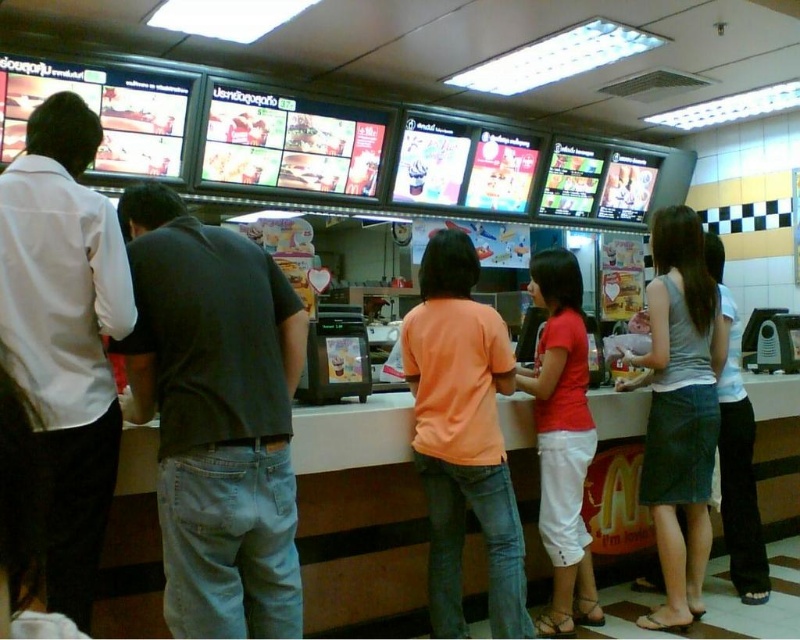
You are a customer at McDonalds and you want to find the dark gray jeans at center. Where would you look in the restaurant?

The dark gray jeans at center are located at the coordinates point (216, 417) in the restaurant.

You are standing at the counter in a McDonalds restaurant and see a point marked at coordinates (680, 410). What object is located at that point?

The point at coordinates (680, 410) corresponds to the denim skirt at center.

You are a customer at McDonalds and you want to order a burger. You see an employee wearing an orange matte shirt at center and another employee in light blue denim jeans at lower right. Which employee is shorter?

The orange matte shirt at center is not as tall as light blue denim jeans at lower right, so the employee wearing the orange matte shirt at center is shorter.